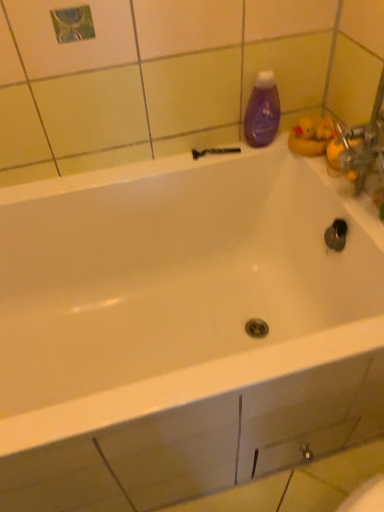
Question: Is purple glossy bottle at upper right oriented towards black plastic shower at upper center?

Choices:
 (A) no
 (B) yes

Answer: (A)

Question: Can you see purple glossy bottle at upper right touching black plastic shower at upper center?

Choices:
 (A) no
 (B) yes

Answer: (A)

Question: Is purple glossy bottle at upper right not within black plastic shower at upper center?

Choices:
 (A) no
 (B) yes

Answer: (B)

Question: Can you confirm if purple glossy bottle at upper right is bigger than black plastic shower at upper center?

Choices:
 (A) yes
 (B) no

Answer: (A)

Question: Is purple glossy bottle at upper right closer to the viewer compared to black plastic shower at upper center?

Choices:
 (A) yes
 (B) no

Answer: (A)

Question: Is purple glossy bottle at upper right at the left side of black plastic shower at upper center?

Choices:
 (A) no
 (B) yes

Answer: (A)

Question: Does black plastic shower at upper center have a lesser height compared to purple glossy bottle at upper right?

Choices:
 (A) no
 (B) yes

Answer: (B)

Question: Is black plastic shower at upper center smaller than purple glossy bottle at upper right?

Choices:
 (A) no
 (B) yes

Answer: (B)

Question: Is purple glossy bottle at upper right completely or partially inside black plastic shower at upper center?

Choices:
 (A) yes
 (B) no

Answer: (B)

Question: Is black plastic shower at upper center with purple glossy bottle at upper right?

Choices:
 (A) no
 (B) yes

Answer: (A)

Question: Is black plastic shower at upper center to the right of purple glossy bottle at upper right from the viewer's perspective?

Choices:
 (A) no
 (B) yes

Answer: (A)

Question: Is black plastic shower at upper center far from purple glossy bottle at upper right?

Choices:
 (A) no
 (B) yes

Answer: (A)

Question: Would you say purple glossy bottle at upper right is to the left or to the right of black plastic shower at upper center in the picture?

Choices:
 (A) right
 (B) left

Answer: (A)